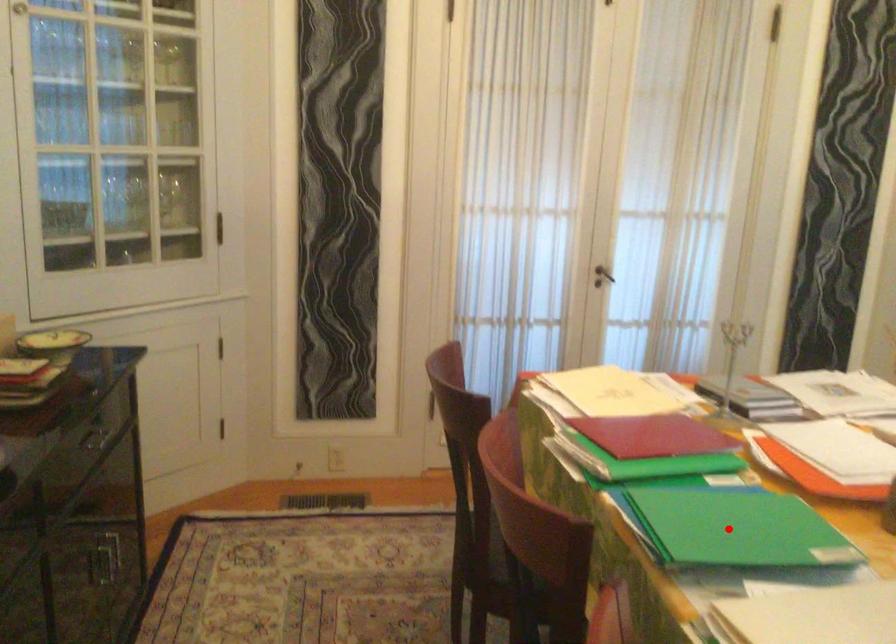
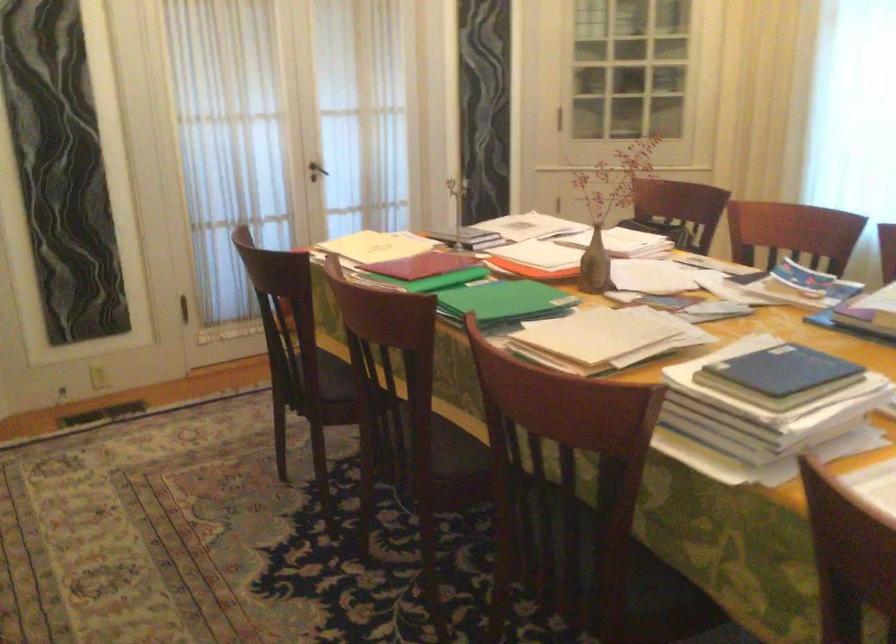
Question: I am providing you with two images of the same scene from different viewpoints. A red point is shown in image1. For the corresponding object point in image2, is it positioned nearer or farther from the camera?

Choices:
 (A) Nearer
 (B) Farther

Answer: (B)